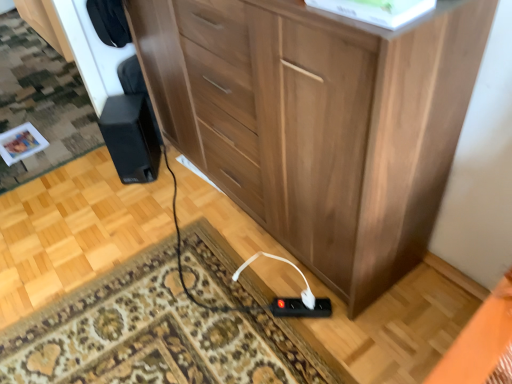
I want to click on free space that is to the left of black plastic power strip at lower center, positioned as the first plug in left-to-right order, so click(249, 319).